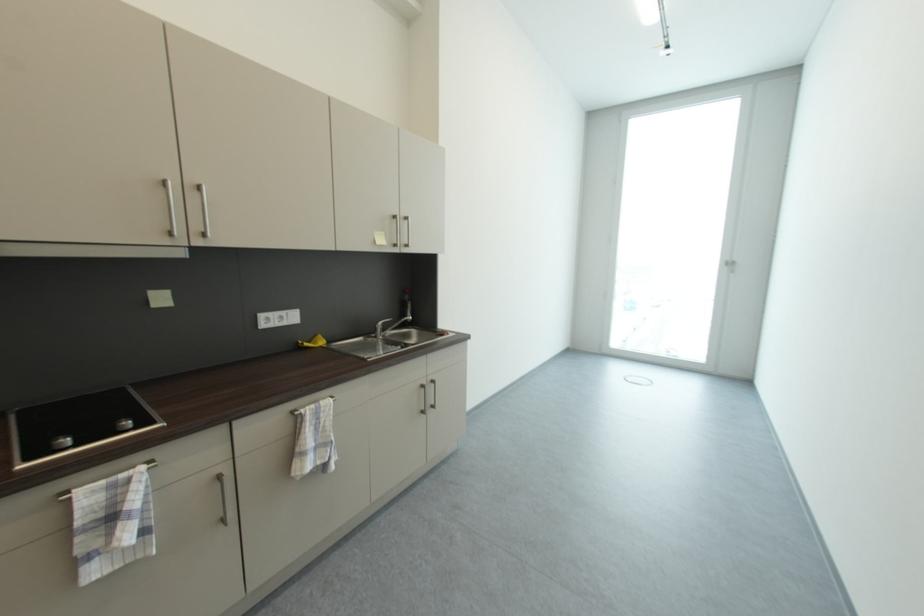
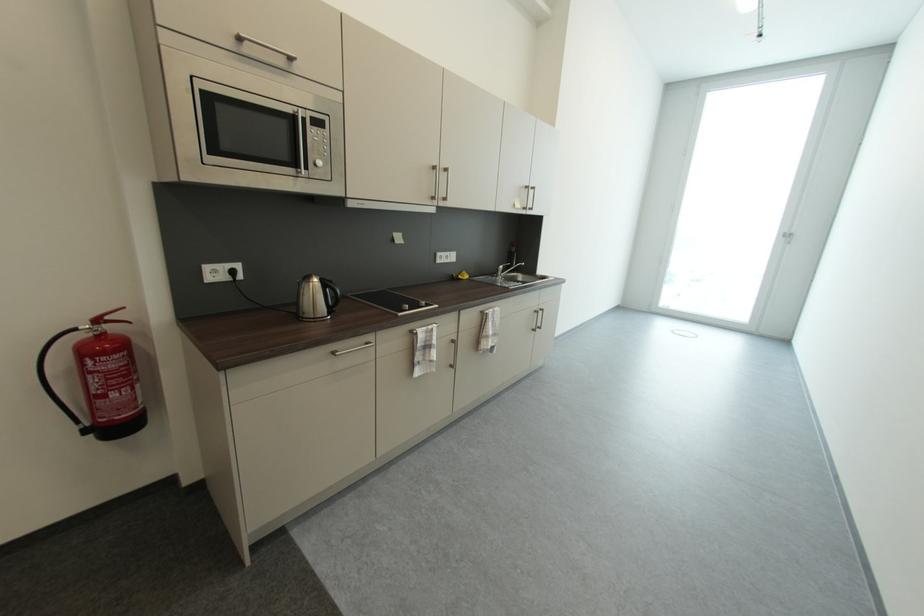
Locate, in the second image, the point that corresponds to point (429, 387) in the first image.

(541, 313)